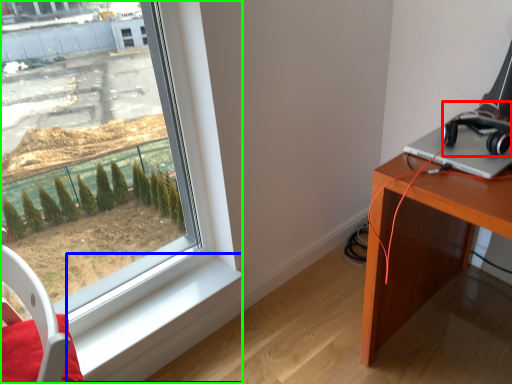
Question: Which object is the closest to the headphones (highlighted by a red box)? Choose among these: window sill (highlighted by a blue box) or window (highlighted by a green box).

Choices:
 (A) window sill
 (B) window

Answer: (B)